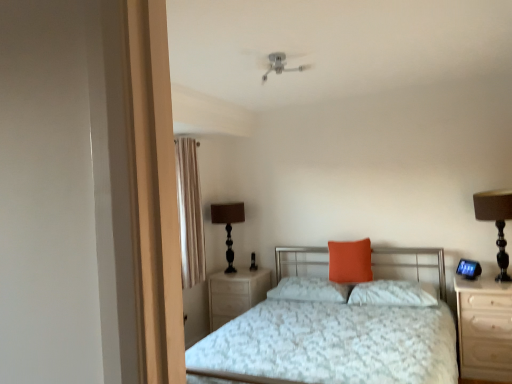
The image size is (512, 384). Describe the element at coordinates (309, 290) in the screenshot. I see `orange fabric pillow at center, which is the 1th pillow in left-to-right order` at that location.

What is the approximate width of light wood/wooden nightstand at center, placed as the 2th nightstand when sorted from right to left?

light wood/wooden nightstand at center, placed as the 2th nightstand when sorted from right to left, is 20.88 inches wide.

Find the location of a particular element. The image size is (512, 384). beige fabric curtain at left is located at coordinates [x=190, y=212].

This screenshot has width=512, height=384. I want to click on orange fabric pillow at center, which is the 2th pillow from left to right, so click(350, 261).

In order to face black glass table lamp at center left, which is the 2th table lamp from right to left, should I rotate leftwards or rightwards?

Rotate left and turn 3.442 degrees.

This screenshot has width=512, height=384. I want to click on orange fabric pillow at center, which is the 1th pillow in left-to-right order, so click(x=309, y=290).

Can you confirm if orange fabric pillow at center, which is counted as the 3th pillow, starting from the right, is bigger than orange fabric pillow at center, the 2th pillow when ordered from right to left?

Yes.

Which is in front, point (300, 278) or point (341, 255)?

The point (341, 255) is more forward.

From a real-world perspective, is orange fabric pillow at center, which is the 1th pillow in left-to-right order, located higher than orange fabric pillow at center, the 2th pillow when ordered from right to left?

No, from a real-world perspective, orange fabric pillow at center, which is the 1th pillow in left-to-right order, is not over orange fabric pillow at center, the 2th pillow when ordered from right to left

From a real-world perspective, which is physically below, black glass table lamp at center left, which is the 2th table lamp from right to left, or white textured bed at center?

From a 3D spatial view, white textured bed at center is below.

Looking at this image, does black glass table lamp at center left, the first table lamp from the back, contain white textured bed at center?

No, white textured bed at center is not surrounded by black glass table lamp at center left, the first table lamp from the back.

Does black glass table lamp at center left, the first table lamp from the back, come behind white textured bed at center?

Yes, black glass table lamp at center left, the first table lamp from the back, is behind white textured bed at center.

Is point (218, 211) positioned before point (210, 363)?

That is False.

Is orange fabric pillow at center, the 2th pillow when ordered from right to left, facing away from light wood/wooden nightstand at right, positioned as the 1th nightstand in right-to-left order?

That's not correct — orange fabric pillow at center, the 2th pillow when ordered from right to left, is not looking away from light wood/wooden nightstand at right, positioned as the 1th nightstand in right-to-left order.

Who is taller, orange fabric pillow at center, which is the 2th pillow from left to right, or light wood/wooden nightstand at right, which is the 1th nightstand from front to back?

light wood/wooden nightstand at right, which is the 1th nightstand from front to back.

How much distance is there between orange fabric pillow at center, the 2th pillow when ordered from right to left, and light wood/wooden nightstand at right, which is the 1th nightstand from front to back?

→ orange fabric pillow at center, the 2th pillow when ordered from right to left, is 38.16 inches from light wood/wooden nightstand at right, which is the 1th nightstand from front to back.

Does orange fabric pillow at center, which is the 2th pillow from left to right, lie behind light wood/wooden nightstand at right, the 2th nightstand from the left?

Yes, it is behind light wood/wooden nightstand at right, the 2th nightstand from the left.

Is orange fabric pillow at center, which is the 2th pillow from left to right, positioned beyond the bounds of brown fabric table lamp at right, placed as the first table lamp when sorted from right to left?

Indeed, orange fabric pillow at center, which is the 2th pillow from left to right, is completely outside brown fabric table lamp at right, placed as the first table lamp when sorted from right to left.

Is orange fabric pillow at center, the 2th pillow when ordered from right to left, positioned in front of brown fabric table lamp at right, the second table lamp when ordered from left to right?

No, the depth of orange fabric pillow at center, the 2th pillow when ordered from right to left, is greater than that of brown fabric table lamp at right, the second table lamp when ordered from left to right.

Consider the image. Is orange fabric pillow at center, the 2th pillow when ordered from right to left, thinner than brown fabric table lamp at right, placed as the first table lamp when sorted from right to left?

Yes, orange fabric pillow at center, the 2th pillow when ordered from right to left, is thinner than brown fabric table lamp at right, placed as the first table lamp when sorted from right to left.

Does point (336, 269) come behind point (218, 315)?

No, (336, 269) is in front of (218, 315).

Is orange fabric pillow at center, the 2th pillow when ordered from right to left, located outside light wood/wooden nightstand at center, placed as the 2th nightstand when sorted from right to left?

That's correct, orange fabric pillow at center, the 2th pillow when ordered from right to left, is outside of light wood/wooden nightstand at center, placed as the 2th nightstand when sorted from right to left.

Is orange fabric pillow at center, which is the 2th pillow from left to right, bigger than light wood/wooden nightstand at center, placed as the 2th nightstand when sorted from right to left?

Incorrect, orange fabric pillow at center, which is the 2th pillow from left to right, is not larger than light wood/wooden nightstand at center, placed as the 2th nightstand when sorted from right to left.

Can you tell me how much brown fabric table lamp at right, the first table lamp in the front-to-back sequence, and light wood/wooden nightstand at right, positioned as the 1th nightstand in right-to-left order, differ in facing direction?

1.57 degrees.

Looking at this image, can we say brown fabric table lamp at right, the first table lamp in the front-to-back sequence, lies outside light wood/wooden nightstand at right, positioned as the 1th nightstand in right-to-left order?

brown fabric table lamp at right, the first table lamp in the front-to-back sequence, is positioned outside light wood/wooden nightstand at right, positioned as the 1th nightstand in right-to-left order.

From the image's perspective, is brown fabric table lamp at right, the second table lamp when ordered from left to right, located above light wood/wooden nightstand at right, the 2th nightstand from the left?

Yes, from the image's perspective, brown fabric table lamp at right, the second table lamp when ordered from left to right, is above light wood/wooden nightstand at right, the 2th nightstand from the left.

Which point is more distant from viewer, (502, 229) or (511, 338)?

Point (502, 229)

Considering the sizes of objects metallic silver mechanical fan at upper center and brown fabric table lamp at right, placed as the first table lamp when sorted from right to left, in the image provided, who is taller, metallic silver mechanical fan at upper center or brown fabric table lamp at right, placed as the first table lamp when sorted from right to left,?

brown fabric table lamp at right, placed as the first table lamp when sorted from right to left, is taller.

Considering the sizes of objects metallic silver mechanical fan at upper center and brown fabric table lamp at right, placed as the first table lamp when sorted from right to left, in the image provided, who is wider, metallic silver mechanical fan at upper center or brown fabric table lamp at right, placed as the first table lamp when sorted from right to left,?

With larger width is metallic silver mechanical fan at upper center.

Identify the location of mechanical fan above the brown fabric table lamp at right, the second table lamp when ordered from left to right (from the image's perspective). (275, 62).

From the image's perspective, between metallic silver mechanical fan at upper center and brown fabric table lamp at right, acting as the 2th table lamp starting from the back, who is located below?

From the image's view, brown fabric table lamp at right, acting as the 2th table lamp starting from the back, is below.

The width and height of the screenshot is (512, 384). Identify the location of the 1st pillow counting from the right of the orange fabric pillow at center, which is the 1th pillow in left-to-right order. (350, 261).

At what (x,y) coordinates should I click in order to perform the action: click on bed in front of the black glass table lamp at center left, which is the 2th table lamp from right to left. Please return your answer as a coordinate pair (x, y). The width and height of the screenshot is (512, 384). Looking at the image, I should click on (334, 332).

Which object lies further to the anchor point light wood/wooden nightstand at center, positioned as the 1th nightstand in back-to-front order, metallic silver mechanical fan at upper center or white textured bed at center?

metallic silver mechanical fan at upper center is positioned further to the anchor light wood/wooden nightstand at center, positioned as the 1th nightstand in back-to-front order.

Considering their positions, is orange fabric pillow at center, which is counted as the 3th pillow, starting from the right, positioned further to black glass table lamp at center left, which is the 2th table lamp from right to left, than orange fabric pillow at center, the 2th pillow when ordered from right to left?

orange fabric pillow at center, the 2th pillow when ordered from right to left, is further to black glass table lamp at center left, which is the 2th table lamp from right to left.

Looking at the image, which one is located further to light wood/wooden nightstand at right, the 2th nightstand from the left, black glass table lamp at center left, which is the first table lamp in left-to-right order, or white textured bed at center?

black glass table lamp at center left, which is the first table lamp in left-to-right order, is further to light wood/wooden nightstand at right, the 2th nightstand from the left.

Estimate the real-world distances between objects in this image. Which object is further from beige fabric curtain at left, metallic silver mechanical fan at upper center or black glass table lamp at center left, the first table lamp from the back?

Based on the image, metallic silver mechanical fan at upper center appears to be further to beige fabric curtain at left.

Estimate the real-world distances between objects in this image. Which object is closer to beige fabric curtain at left, brown fabric table lamp at right, the second table lamp when ordered from left to right, or orange fabric pillow at center, which is counted as the 3th pillow, starting from the right?

The object closer to beige fabric curtain at left is orange fabric pillow at center, which is counted as the 3th pillow, starting from the right.

When comparing their distances from brown fabric table lamp at right, the second table lamp when ordered from left to right, does metallic silver mechanical fan at upper center or orange fabric pillow at center, acting as the 1th pillow starting from the right, seem closer?

The object closer to brown fabric table lamp at right, the second table lamp when ordered from left to right, is orange fabric pillow at center, acting as the 1th pillow starting from the right.

Considering their positions, is orange fabric pillow at center, which is the 2th pillow from left to right, positioned closer to brown fabric table lamp at right, acting as the 2th table lamp starting from the back, than metallic silver mechanical fan at upper center?

orange fabric pillow at center, which is the 2th pillow from left to right, is positioned closer to the anchor brown fabric table lamp at right, acting as the 2th table lamp starting from the back.

Considering their positions, is white textured bed at center positioned closer to black glass table lamp at center left, the first table lamp from the back, than orange fabric pillow at center, acting as the 1th pillow starting from the right?

white textured bed at center.

This screenshot has width=512, height=384. I want to click on mechanical fan between beige fabric curtain at left and orange fabric pillow at center, acting as the 1th pillow starting from the right, so click(275, 62).

At what (x,y) coordinates should I click in order to perform the action: click on mechanical fan between light wood/wooden nightstand at center, placed as the 2th nightstand when sorted from right to left, and brown fabric table lamp at right, the first table lamp in the front-to-back sequence. Please return your answer as a coordinate pair (x, y). This screenshot has height=384, width=512. Looking at the image, I should click on [x=275, y=62].

Locate an element on the screen. This screenshot has width=512, height=384. curtain between white textured bed at center and light wood/wooden nightstand at center, positioned as the 1th nightstand in back-to-front order, along the z-axis is located at coordinates (190, 212).

What are the coordinates of `table lamp situated between beige fabric curtain at left and orange fabric pillow at center, which is the 2th pillow from left to right, from left to right` in the screenshot? It's located at (228, 225).